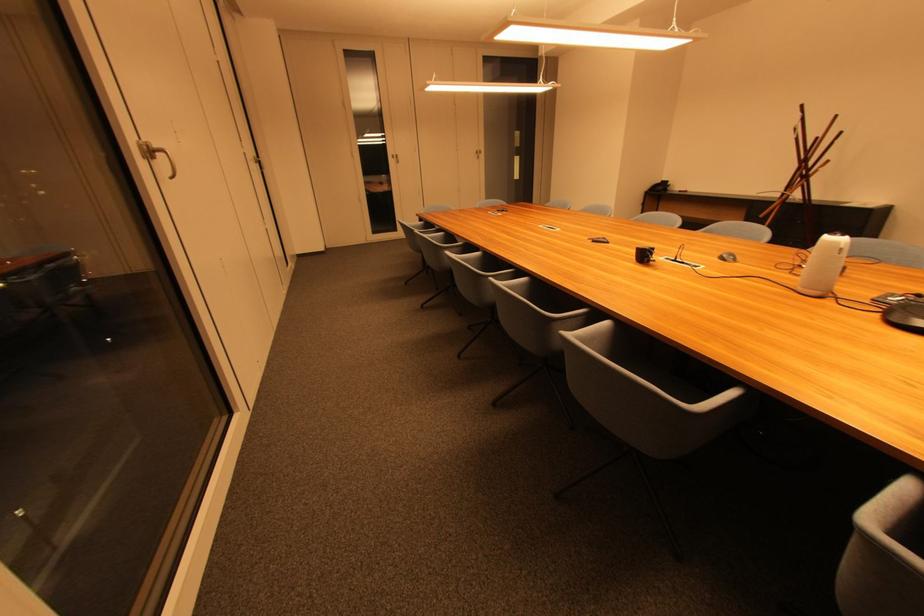
In order to click on black webcam in this screenshot , I will do `click(643, 254)`.